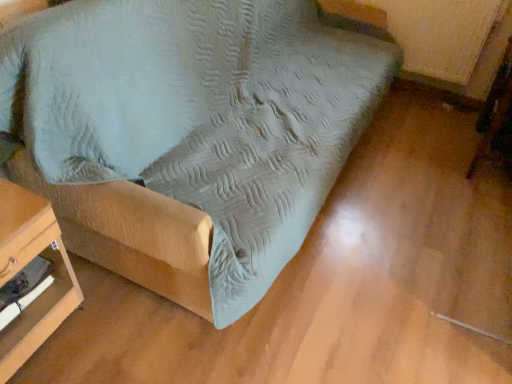
Question: Is suede-like fabric couch at center, the 2th furniture when ordered from left to right, bigger than wooden table at lower left, which ranks as the first furniture in left-to-right order?

Choices:
 (A) no
 (B) yes

Answer: (B)

Question: From the image's perspective, is suede-like fabric couch at center, the 2th furniture when ordered from left to right, over wooden table at lower left, which ranks as the first furniture in left-to-right order?

Choices:
 (A) no
 (B) yes

Answer: (B)

Question: Can you confirm if suede-like fabric couch at center, the 2th furniture when ordered from left to right, is smaller than wooden table at lower left, the 2th furniture when ordered from right to left?

Choices:
 (A) yes
 (B) no

Answer: (B)

Question: Is suede-like fabric couch at center, the 2th furniture when ordered from left to right, wider than wooden table at lower left, which ranks as the first furniture in left-to-right order?

Choices:
 (A) yes
 (B) no

Answer: (A)

Question: Does suede-like fabric couch at center, the 2th furniture when ordered from left to right, come behind wooden table at lower left, the 2th furniture when ordered from right to left?

Choices:
 (A) yes
 (B) no

Answer: (B)

Question: Is wooden swivel chair at lower right wider or thinner than suede-like fabric couch at center, the 2th furniture when ordered from left to right?

Choices:
 (A) wide
 (B) thin

Answer: (B)

Question: From the image's perspective, is wooden swivel chair at lower right above or below suede-like fabric couch at center, the 2th furniture when ordered from left to right?

Choices:
 (A) above
 (B) below

Answer: (B)

Question: From a real-world perspective, relative to suede-like fabric couch at center, the 2th furniture when ordered from left to right, is wooden swivel chair at lower right vertically above or below?

Choices:
 (A) below
 (B) above

Answer: (A)

Question: Looking at the image, does wooden swivel chair at lower right seem bigger or smaller compared to suede-like fabric couch at center, the 2th furniture when ordered from left to right?

Choices:
 (A) big
 (B) small

Answer: (B)

Question: From a real-world perspective, is suede-like fabric couch at center, the 2th furniture when ordered from left to right, physically located above or below wooden swivel chair at lower right?

Choices:
 (A) above
 (B) below

Answer: (A)

Question: Is suede-like fabric couch at center, placed as the 1th furniture when sorted from right to left, bigger or smaller than wooden swivel chair at lower right?

Choices:
 (A) big
 (B) small

Answer: (A)

Question: In terms of width, does suede-like fabric couch at center, placed as the 1th furniture when sorted from right to left, look wider or thinner when compared to wooden swivel chair at lower right?

Choices:
 (A) wide
 (B) thin

Answer: (A)

Question: Based on their positions, is suede-like fabric couch at center, the 2th furniture when ordered from left to right, located to the left or right of wooden swivel chair at lower right?

Choices:
 (A) right
 (B) left

Answer: (B)

Question: From a real-world perspective, is wooden table at lower left, the 2th furniture when ordered from right to left, physically located above or below wooden swivel chair at lower right?

Choices:
 (A) below
 (B) above

Answer: (A)

Question: Is wooden table at lower left, which ranks as the first furniture in left-to-right order, in front of or behind wooden swivel chair at lower right in the image?

Choices:
 (A) behind
 (B) front

Answer: (B)